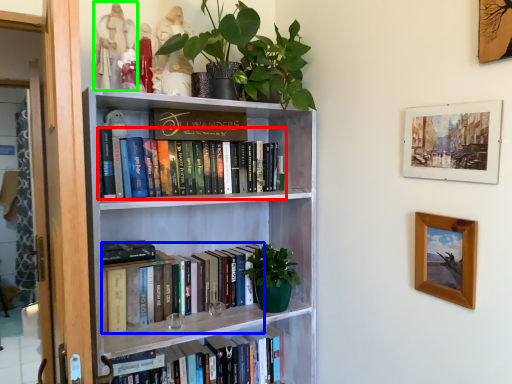
Question: Which is nearer to the book (highlighted by a red box)? book (highlighted by a blue box) or toy (highlighted by a green box).

Choices:
 (A) book
 (B) toy

Answer: (A)